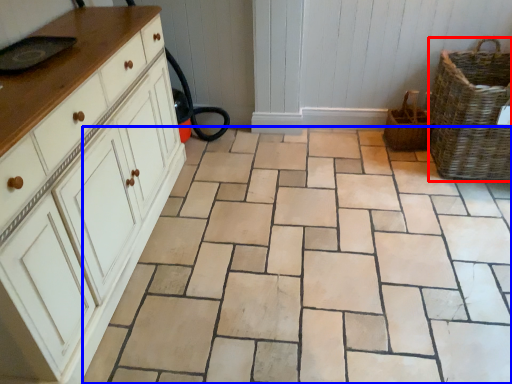
Question: Which of the following is the farthest to the observer, basket (highlighted by a red box) or ceramic tile (highlighted by a blue box)?

Choices:
 (A) basket
 (B) ceramic tile

Answer: (A)